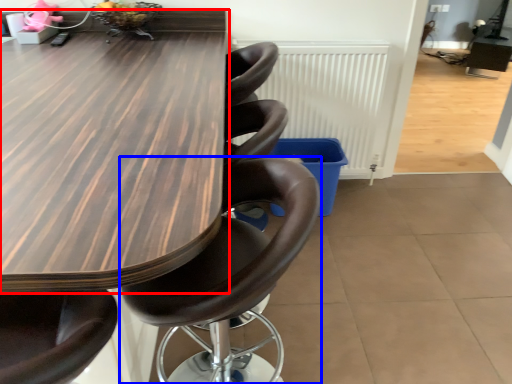
Question: Among these objects, which one is nearest to the camera, table (highlighted by a red box) or chair (highlighted by a blue box)?

Choices:
 (A) table
 (B) chair

Answer: (A)